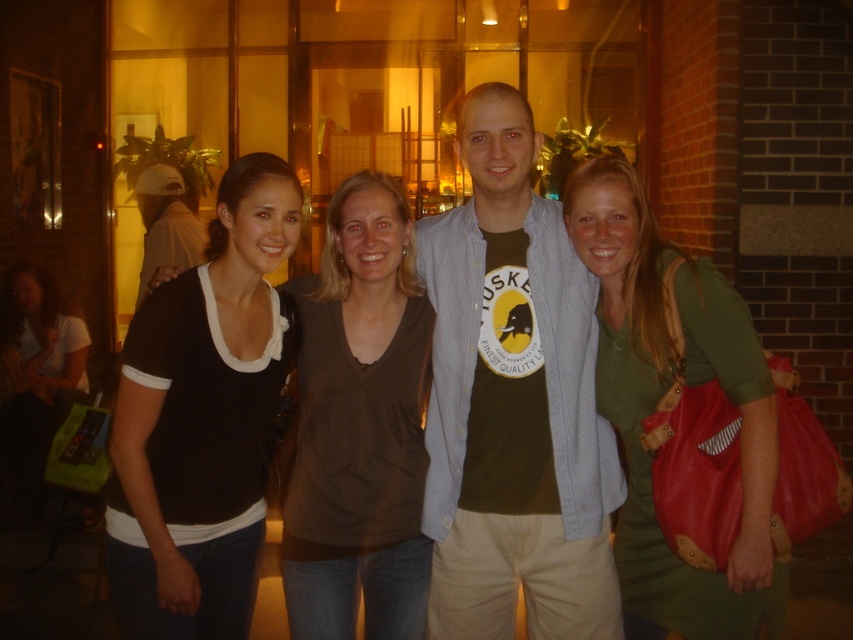
Question: Considering the relative positions of black matte shirt at left and black cotton shirt at center in the image provided, where is black matte shirt at left located with respect to black cotton shirt at center?

Choices:
 (A) left
 (B) right

Answer: (A)

Question: In this image, where is matte brown t-shirt at center located relative to black cotton shirt at center?

Choices:
 (A) below
 (B) above

Answer: (B)

Question: Can you confirm if black matte shirt at left is thinner than green fabric dress at right?

Choices:
 (A) no
 (B) yes

Answer: (B)

Question: Which of the following is the farthest from the observer?

Choices:
 (A) (482, 460)
 (B) (746, 586)
 (C) (236, 636)

Answer: (A)

Question: Among these points, which one is farthest from the camera?

Choices:
 (A) (514, 339)
 (B) (759, 380)

Answer: (A)

Question: Based on their relative distances, which object is farther from the black cotton shirt at center?

Choices:
 (A) matte black shirt at left
 (B) green fabric dress at right

Answer: (A)